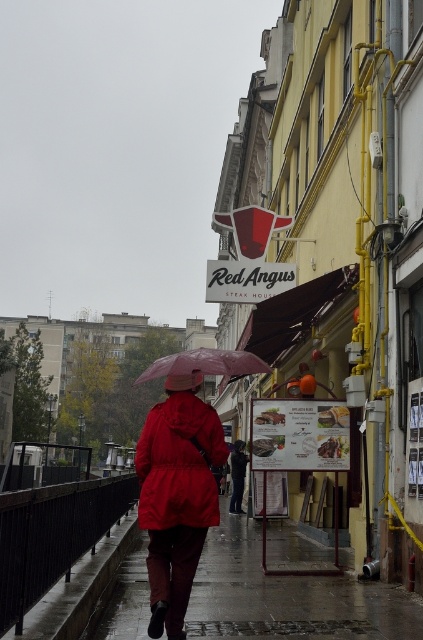
Question: Does matte red jacket at center appear on the right side of transparent plastic umbrella at center?

Choices:
 (A) no
 (B) yes

Answer: (A)

Question: Among these objects, which one is nearest to the camera?

Choices:
 (A) transparent plastic umbrella at center
 (B) wet asphalt pavement at lower center
 (C) matte red jacket at center

Answer: (C)

Question: Can you confirm if wet asphalt pavement at lower center is bigger than matte red jacket at center?

Choices:
 (A) yes
 (B) no

Answer: (A)

Question: Which object is farther from the camera taking this photo?

Choices:
 (A) transparent plastic umbrella at center
 (B) wet asphalt pavement at lower center
 (C) matte red jacket at center

Answer: (B)

Question: Which point appears closest to the camera in this image?

Choices:
 (A) (228, 630)
 (B) (176, 500)
 (C) (242, 369)

Answer: (B)

Question: Is wet asphalt pavement at lower center thinner than transparent plastic umbrella at center?

Choices:
 (A) no
 (B) yes

Answer: (A)